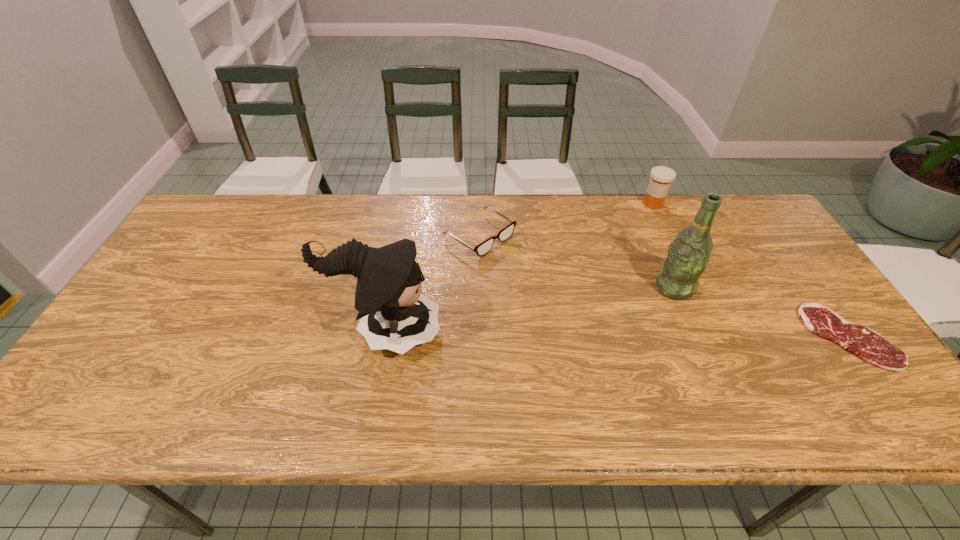
The image size is (960, 540). I want to click on vacant area situated 0.330m on the label of the third shortest object, so click(653, 281).

Find the location of a particular element. This screenshot has width=960, height=540. vacant space situated 0.090m on the label of the third shortest object is located at coordinates (653, 227).

Identify the location of free location located 0.170m on the label of the third shortest object. (653, 244).

Image resolution: width=960 pixels, height=540 pixels. I want to click on vacant space located on the front-facing side of the fourth nearest object, so click(x=610, y=321).

Where is `blank area located on the front-facing side of the fourth nearest object`? blank area located on the front-facing side of the fourth nearest object is located at coordinates (518, 261).

At what (x,y) coordinates should I click in order to perform the action: click on vacant space located on the front-facing side of the fourth nearest object. Please return your answer as a coordinate pair (x, y). The height and width of the screenshot is (540, 960). Looking at the image, I should click on (575, 298).

Find the location of a particular element. Image resolution: width=960 pixels, height=540 pixels. vacant space located on the surface of the beer bottle is located at coordinates 626,315.

In order to click on free region located on the surface of the beer bottle in this screenshot , I will do `click(553, 357)`.

This screenshot has height=540, width=960. In order to click on vacant space located on the surface of the beer bottle in this screenshot , I will do `click(609, 325)`.

You are a GUI agent. You are given a task and a screenshot of the screen. Output one action in this format:
    pyautogui.click(x=<x>, y=<y>)
    Task: Click on the medicine present at the far edge
    
    Given the screenshot: What is the action you would take?
    click(x=661, y=177)